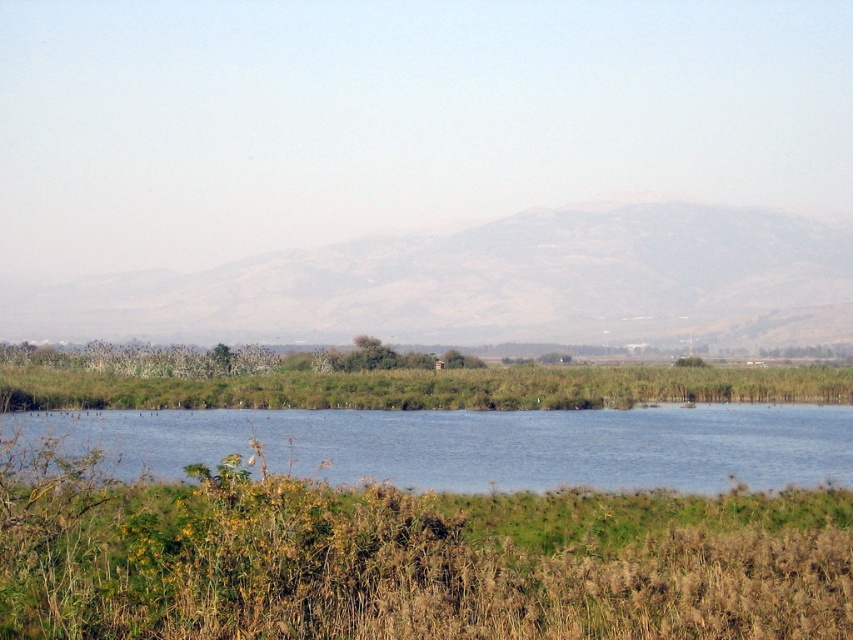
Can you confirm if gray textured mountain at center is bigger than blue water at center?

Correct, gray textured mountain at center is larger in size than blue water at center.

From the picture: Is gray textured mountain at center shorter than blue water at center?

No.

Where is `gray textured mountain at center`? The image size is (853, 640). gray textured mountain at center is located at coordinates (480, 284).

Does gray textured mountain at center have a smaller size compared to green grassy reeds at center?

No, gray textured mountain at center is not smaller than green grassy reeds at center.

This screenshot has height=640, width=853. What do you see at coordinates (480, 284) in the screenshot?
I see `gray textured mountain at center` at bounding box center [480, 284].

You are a GUI agent. You are given a task and a screenshot of the screen. Output one action in this format:
    pyautogui.click(x=<x>, y=<y>)
    Task: Click on the gray textured mountain at center
    
    Given the screenshot: What is the action you would take?
    pyautogui.click(x=480, y=284)

Is point (364, 451) positioned after point (167, 400)?

That is False.

In the scene shown: Is the position of blue water at center less distant than that of green grassy reeds at center?

Yes, blue water at center is closer to the viewer.

Which is behind, point (660, 460) or point (25, 362)?

Positioned behind is point (25, 362).

The height and width of the screenshot is (640, 853). I want to click on blue water at center, so click(479, 444).